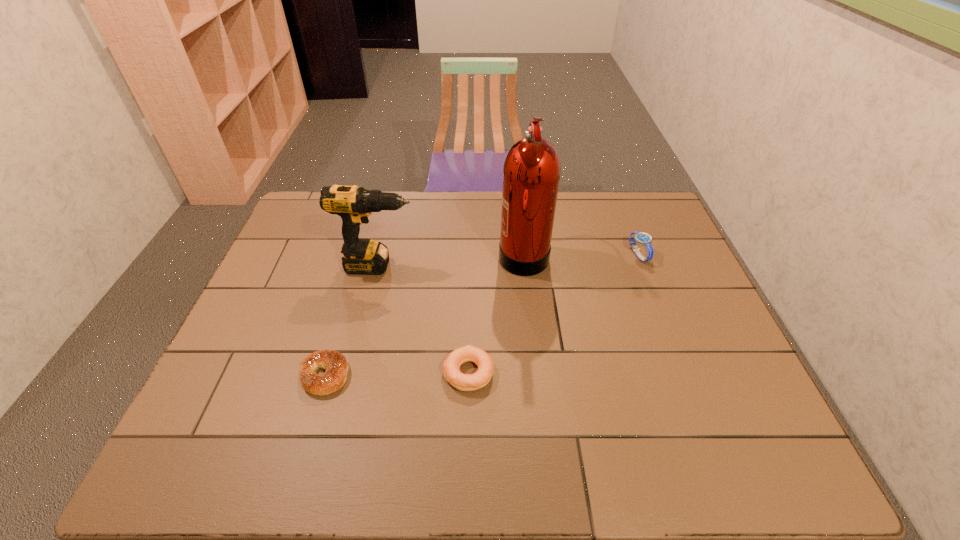
Locate an element on the screen. The width and height of the screenshot is (960, 540). the tallest object is located at coordinates (531, 173).

What are the coordinates of `fire extinguisher` in the screenshot? It's located at (531, 173).

Locate an element on the screen. drill is located at coordinates (353, 204).

The height and width of the screenshot is (540, 960). I want to click on the third shortest object, so click(x=643, y=238).

You are a GUI agent. You are given a task and a screenshot of the screen. Output one action in this format:
    pyautogui.click(x=<x>, y=<y>)
    Task: Click on the watch
    Image resolution: width=960 pixels, height=540 pixels.
    Given the screenshot: What is the action you would take?
    pyautogui.click(x=643, y=238)

This screenshot has width=960, height=540. I want to click on the third object from left to right, so click(451, 367).

Image resolution: width=960 pixels, height=540 pixels. What are the coordinates of `the left bagel` in the screenshot? It's located at (336, 366).

Locate an element on the screen. vacant space located 0.360m on the front-facing side of the second object from right to left is located at coordinates (384, 253).

I want to click on vacant space located on the front-facing side of the second object from right to left, so click(384, 253).

Identify the location of vacant region located 0.050m on the front-facing side of the second object from right to left. Image resolution: width=960 pixels, height=540 pixels. (483, 253).